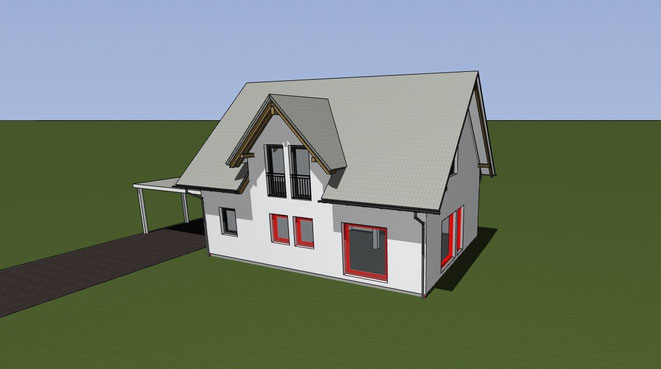
The image size is (661, 369). Find the location of `frame`. frame is located at coordinates (264, 164).